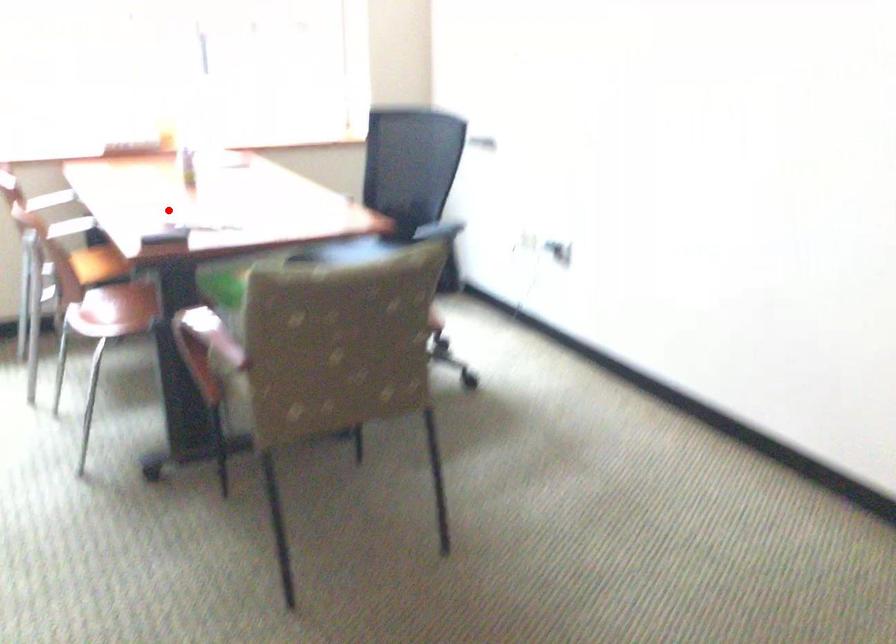
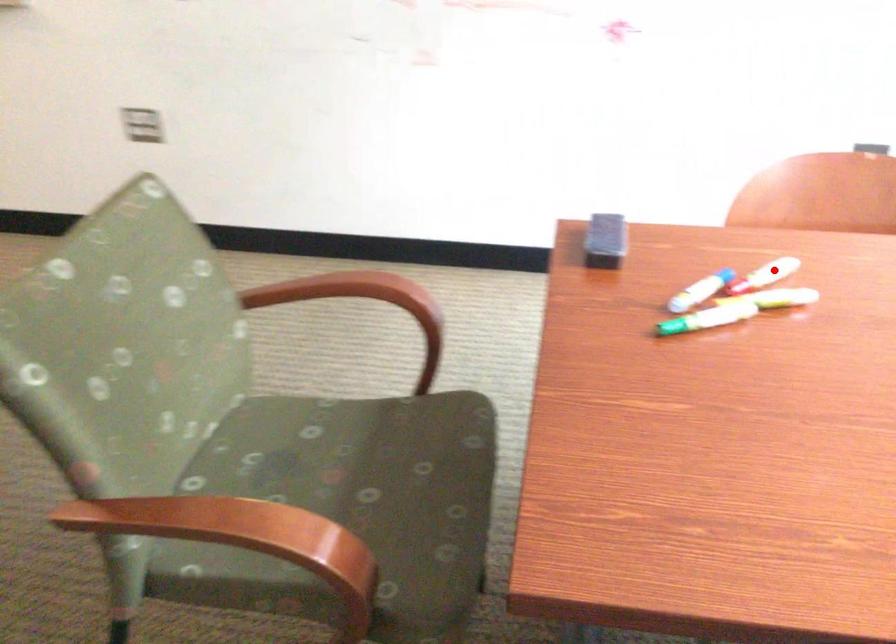
I am providing you with two images of the same scene from different viewpoints. A red point is marked on the first image and another point is marked on the second image. Do the highlighted points in image1 and image2 indicate the same real-world spot?

Yes